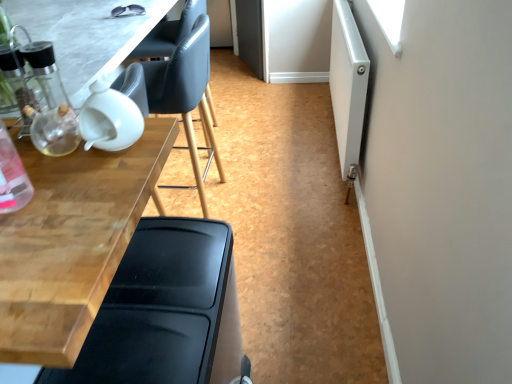
What are the coordinates of `vacant area that lies to the right of matte black chair at upper left, which ranks as the first chair in back-to-front order` in the screenshot? It's located at (264, 201).